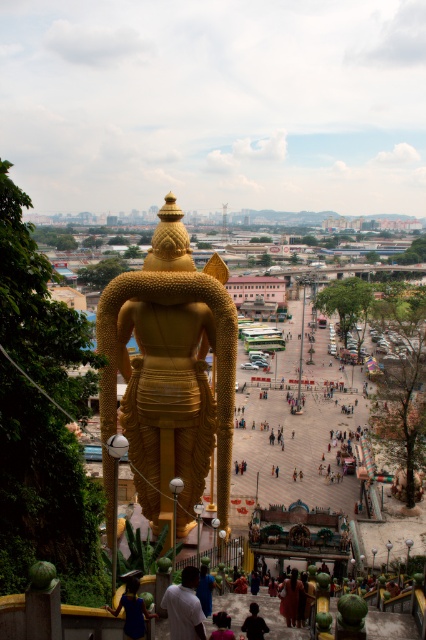
You are a photographer positioned at the back of the statue, aiming to capture both the matte red dress at center and the dark fabric shirt at center in your shot. Which clothing item will appear closer to the camera in the photo?

The matte red dress at center is further to the viewer than the dark fabric shirt at center, so it will appear closer to the camera in the photo.

You are a photographer standing in the plaza and see the blue fabric dress at lower center and the dark purple fabric at lower center. Which one would appear larger in your photo if you focus on them both?

The blue fabric dress at lower center would appear larger in the photo because it is closer to the viewer than the dark purple fabric at lower center.